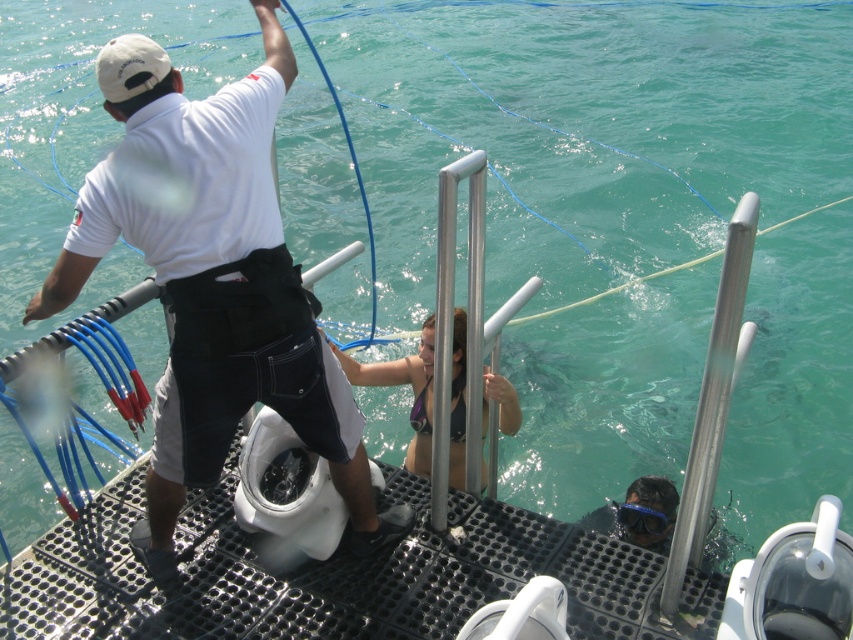
Question: Is white matte sailor at upper left positioned behind matte black bikini at center?

Choices:
 (A) no
 (B) yes

Answer: (A)

Question: Which object appears farthest from the camera in this image?

Choices:
 (A) white matte sailor at upper left
 (B) matte black bikini at center

Answer: (B)

Question: Does white matte sailor at upper left appear over matte black bikini at center?

Choices:
 (A) no
 (B) yes

Answer: (B)

Question: Which point appears closest to the camera in this image?

Choices:
 (A) 247,264
 (B) 430,420

Answer: (A)

Question: Is white matte sailor at upper left to the left of matte black bikini at center from the viewer's perspective?

Choices:
 (A) no
 (B) yes

Answer: (B)